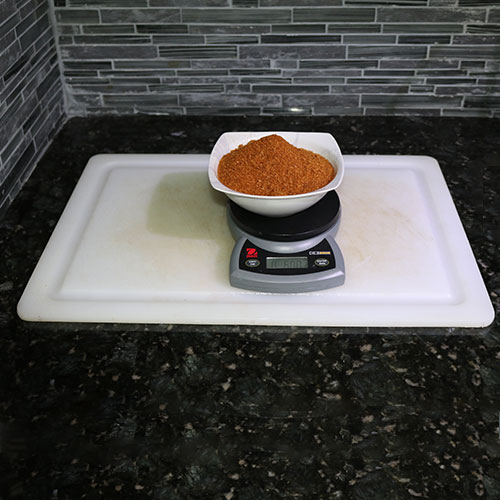
Where is `black marble counterotp`? The image size is (500, 500). black marble counterotp is located at coordinates (245, 416).